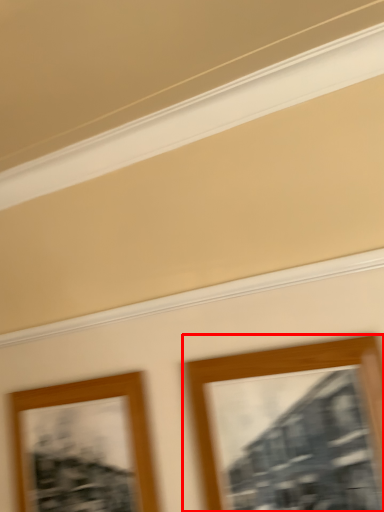
Question: Considering the relative positions of picture frame (annotated by the red box) and picture frame in the image provided, where is picture frame (annotated by the red box) located with respect to the staircase?

Choices:
 (A) right
 (B) left

Answer: (A)